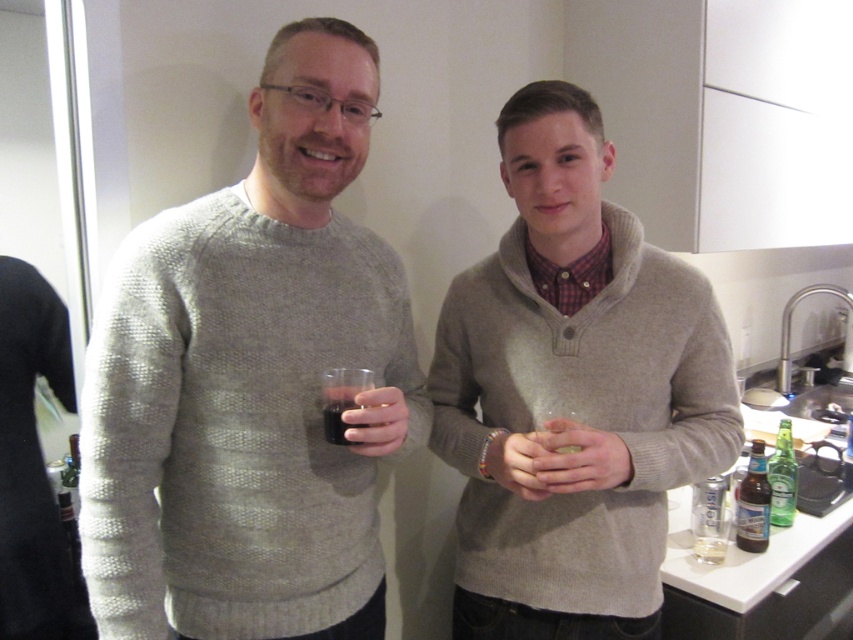
Which is more to the right, matte gray sweater at center or brown glass bottle at lower right?

brown glass bottle at lower right

Can you confirm if matte gray sweater at center is shorter than brown glass bottle at lower right?

In fact, matte gray sweater at center may be taller than brown glass bottle at lower right.

Is point (666, 408) farther from camera compared to point (759, 484)?

No.

I want to click on matte gray sweater at center, so click(x=572, y=388).

Looking at this image, is the position of matte gray sweater at center more distant than that of green glass bottle at lower right?

No, it is in front of green glass bottle at lower right.

Between matte gray sweater at center and green glass bottle at lower right, which one appears on the right side from the viewer's perspective?

green glass bottle at lower right

The width and height of the screenshot is (853, 640). Identify the location of matte gray sweater at center. (572, 388).

In the scene shown: Between matte plastic cup at center and green glass bottle at lower right, which one has more height?

With more height is green glass bottle at lower right.

Which is behind, point (395, 442) or point (776, 483)?

The point (776, 483) is behind.

You are a GUI agent. You are given a task and a screenshot of the screen. Output one action in this format:
    pyautogui.click(x=<x>, y=<y>)
    Task: Click on the matte plastic cup at center
    The height and width of the screenshot is (640, 853).
    Given the screenshot: What is the action you would take?
    pyautogui.click(x=376, y=420)